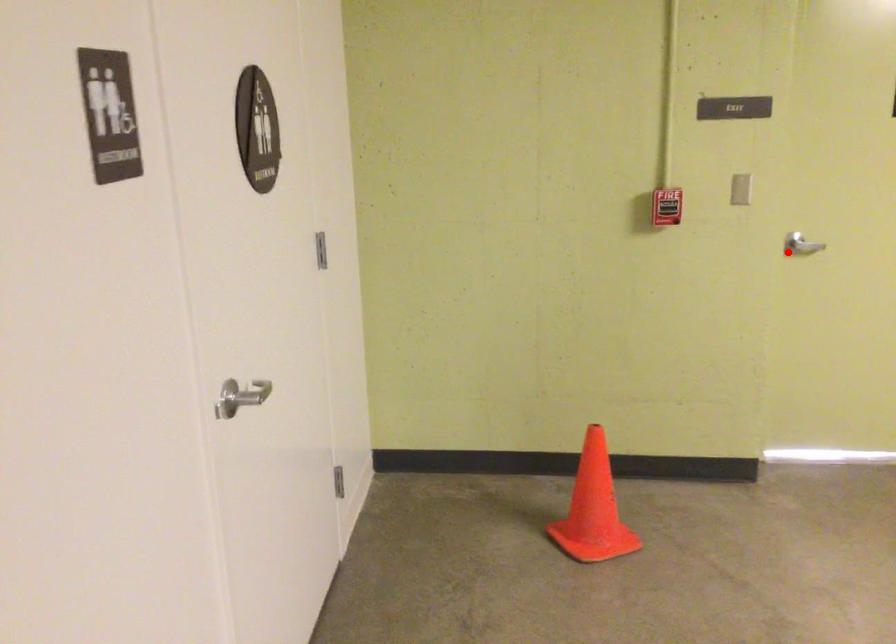
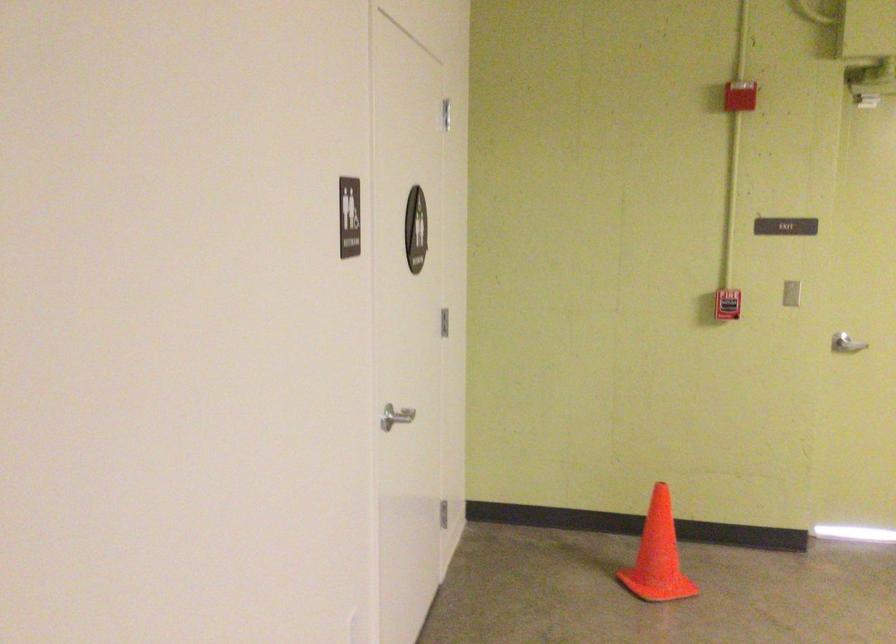
Question: I am providing you with two images of the same scene from different viewpoints. Image1 has a red point marked. In image2, the corresponding 3D location appears at what relative position? Reply with the corresponding letter.

Choices:
 (A) Closer
 (B) Farther

Answer: (B)